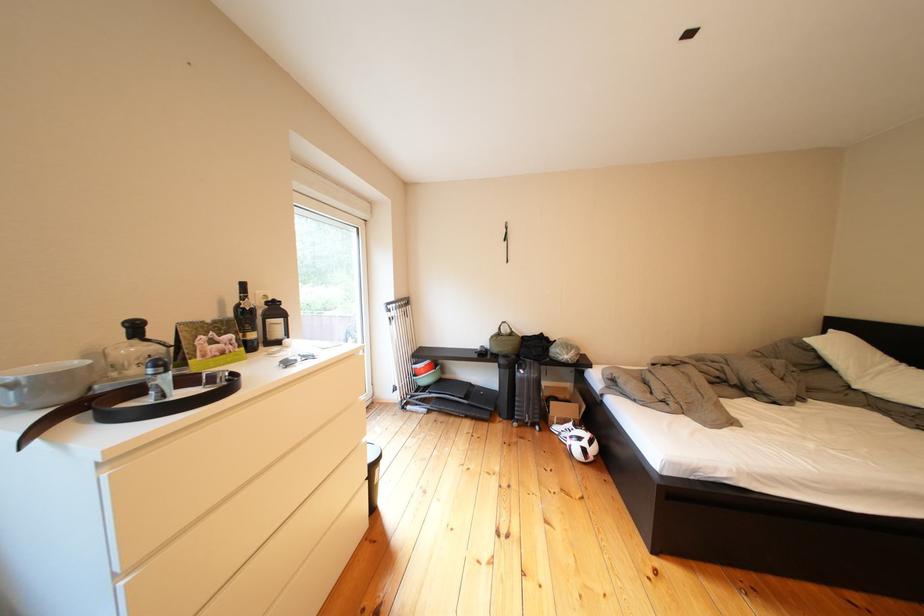
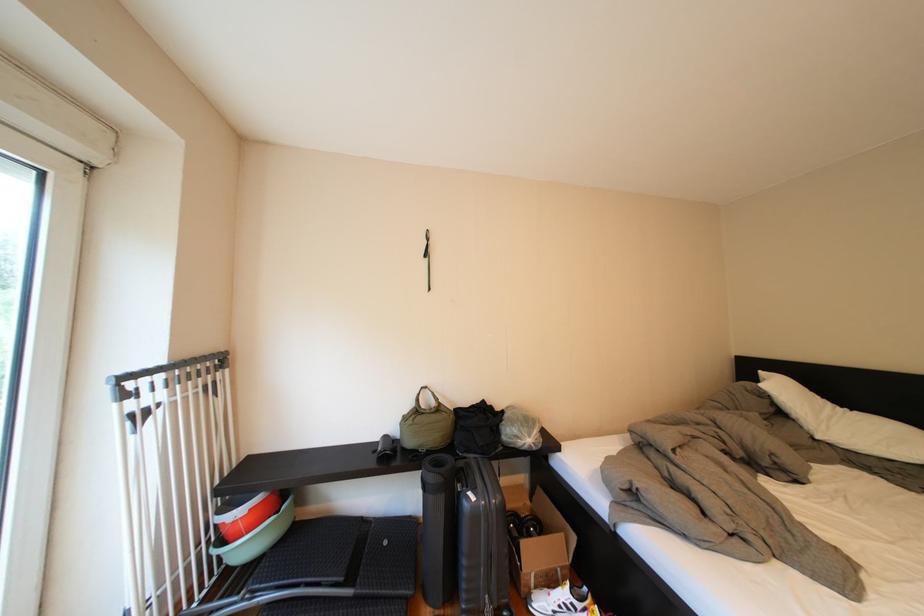
The point at [536,377] is marked in the first image. Where is the corresponding point in the second image?

(487, 503)